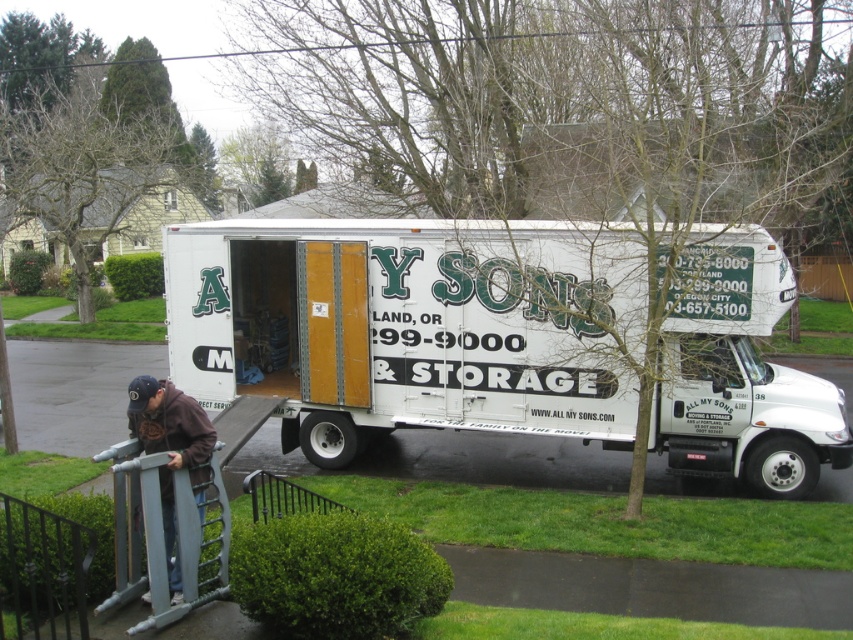
You are standing in the driveway and want to place a small potted plant between the two points, point [190,444] and point [289,506]. Which point should you start closer to the truck to ensure the plant is placed correctly?

Point [190,444] is closer to the viewer than point [289,506]. To place the potted plant between them, you should start closer to the truck at point [190,444] since it is nearer to you.